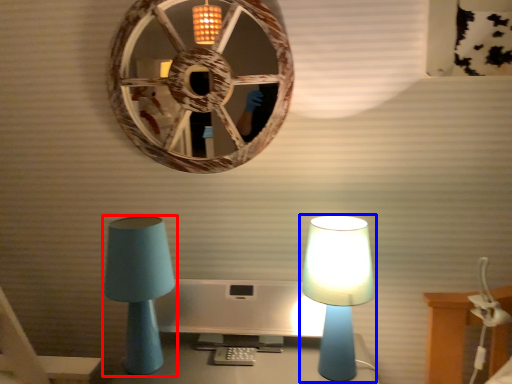
Question: Which of the following is the closest to the observer, lamp (highlighted by a red box) or lamp (highlighted by a blue box)?

Choices:
 (A) lamp
 (B) lamp

Answer: (B)